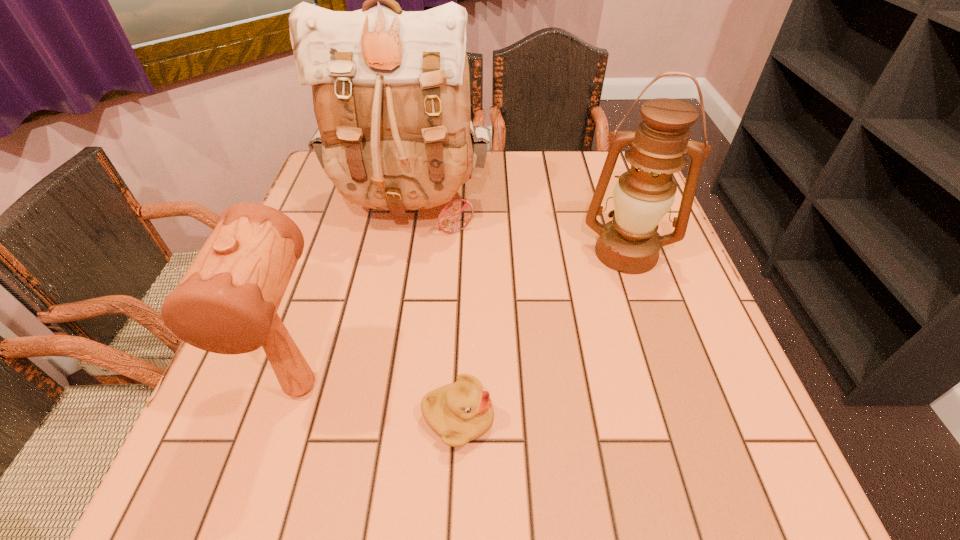
Where is `free point between the rightmost object and the mallet`? free point between the rightmost object and the mallet is located at coordinates (464, 320).

Locate an element on the screen. The height and width of the screenshot is (540, 960). free spot between the third shortest object and the backpack is located at coordinates (518, 230).

In order to click on vacant area between the rightmost object and the shortest object in this screenshot , I will do `click(542, 335)`.

Locate an element on the screen. The image size is (960, 540). object that is the second closest to the duckling is located at coordinates (391, 91).

This screenshot has width=960, height=540. What are the coordinates of `object that is the second closest to the shortest object` in the screenshot? It's located at (391, 91).

This screenshot has width=960, height=540. I want to click on blank area in the image that satisfies the following two spatial constraints: 1. on the front-facing side of the third shortest object; 2. on the right side of the backpack, so click(401, 253).

Where is `vacant space that satisfies the following two spatial constraints: 1. on the front-facing side of the backpack; 2. on the right side of the oil lamp`? The height and width of the screenshot is (540, 960). vacant space that satisfies the following two spatial constraints: 1. on the front-facing side of the backpack; 2. on the right side of the oil lamp is located at coordinates (401, 253).

The width and height of the screenshot is (960, 540). In order to click on free space that satisfies the following two spatial constraints: 1. on the front-facing side of the backpack; 2. on the right side of the oil lamp in this screenshot , I will do `click(401, 253)`.